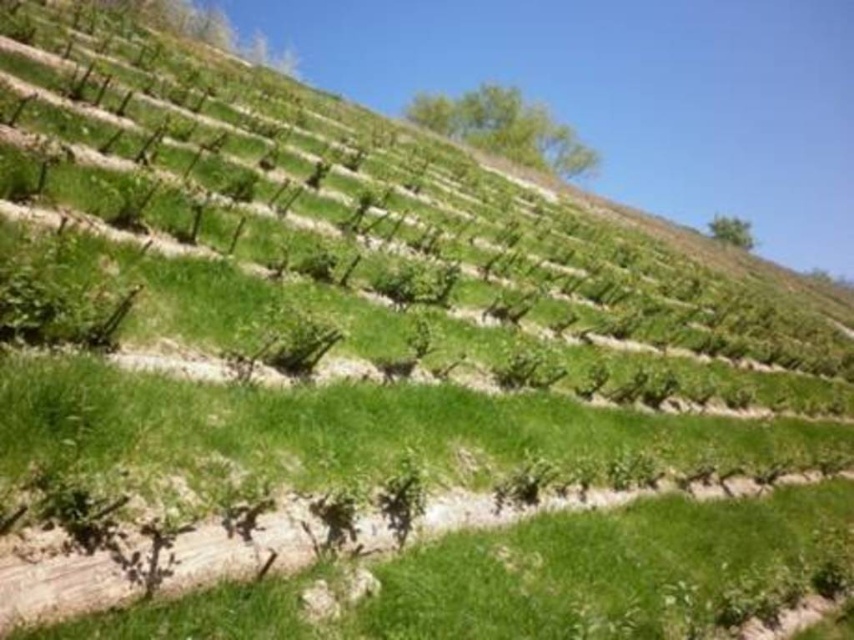
Question: Among these points, which one is farthest from the camera?

Choices:
 (A) (575, 141)
 (B) (746, 241)

Answer: (B)

Question: Is green leafy tree at upper center bigger than green leafy tree at upper right?

Choices:
 (A) yes
 (B) no

Answer: (A)

Question: Does green leafy tree at upper center appear on the right side of green leafy tree at upper right?

Choices:
 (A) no
 (B) yes

Answer: (A)

Question: Which object appears closest to the camera in this image?

Choices:
 (A) green leafy tree at upper right
 (B) green leafy tree at upper center

Answer: (B)

Question: Where is green leafy tree at upper center located in relation to green leafy tree at upper right in the image?

Choices:
 (A) right
 (B) left

Answer: (B)